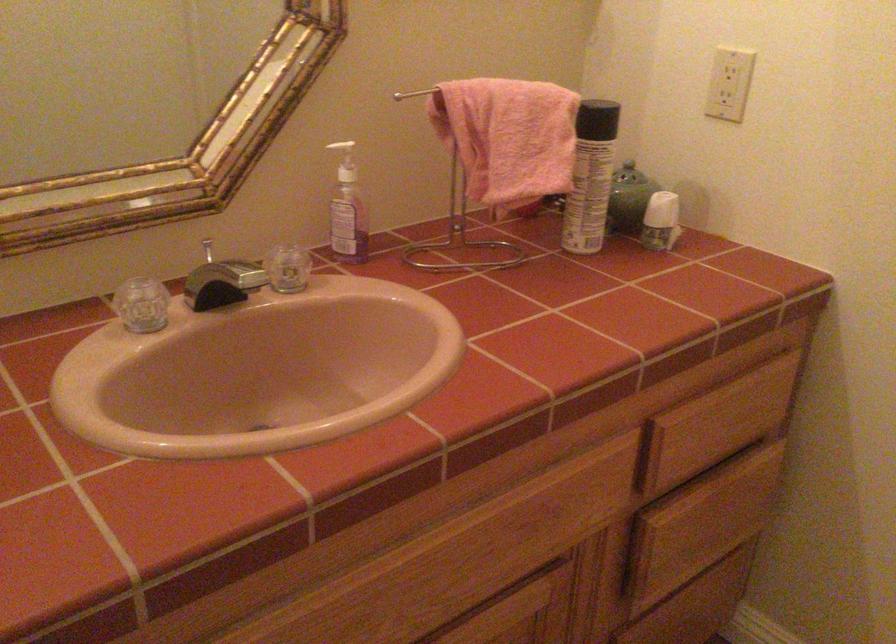
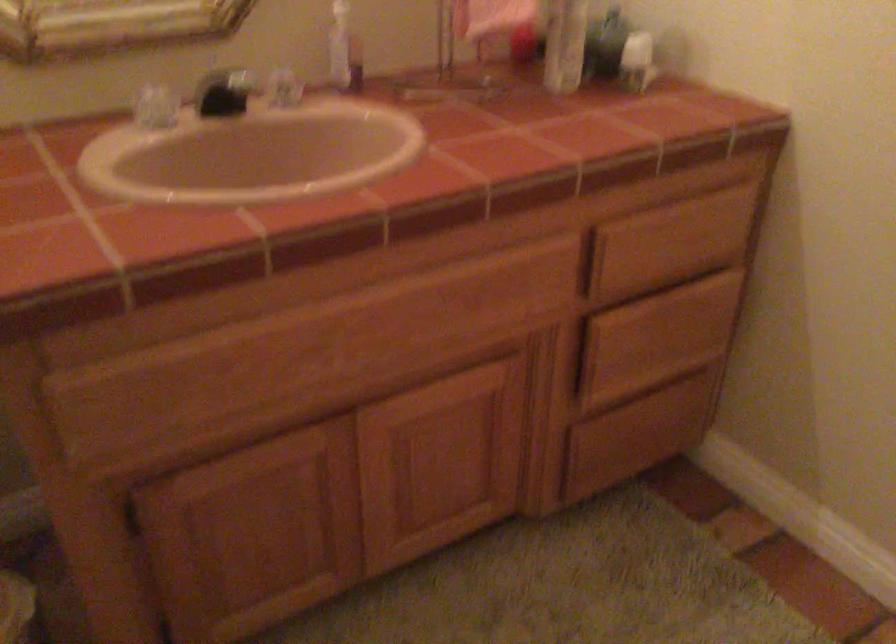
In the second image, find the point that corresponds to the point at 722,424 in the first image.

(668, 243)